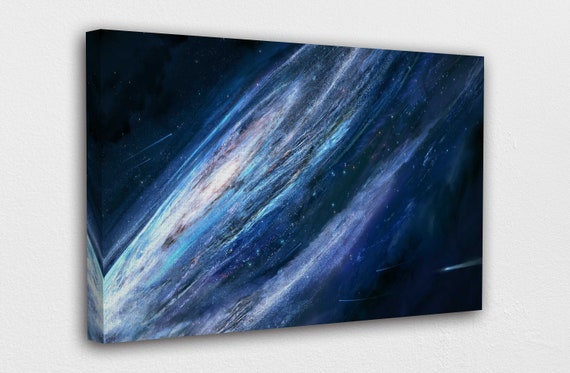
At what (x,y) coordinates should I click in order to perform the action: click on white wall. Please return your answer as a coordinate pair (x, y). This screenshot has height=373, width=570. Looking at the image, I should click on point(538,262).